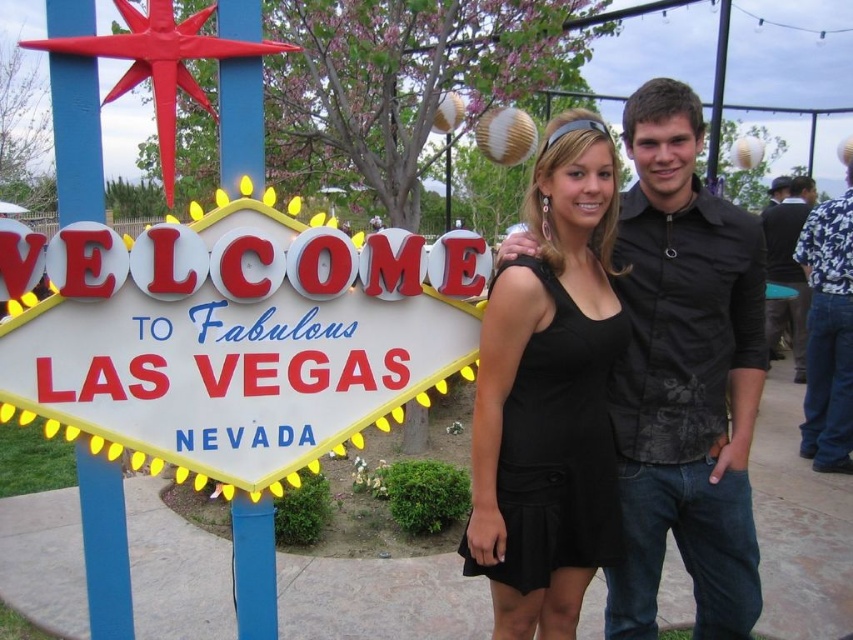
Question: Can you confirm if metallic red sign at left is positioned below black satin dress at center?

Choices:
 (A) yes
 (B) no

Answer: (B)

Question: Which point is farther to the camera?

Choices:
 (A) (775, 241)
 (B) (476, 396)
 (C) (677, 524)
 (D) (228, 452)

Answer: (A)

Question: Is black matte shirt at center below black satin dress at center?

Choices:
 (A) no
 (B) yes

Answer: (B)

Question: Which point is farther to the camera?

Choices:
 (A) (630, 422)
 (B) (577, 369)
 (C) (225, 260)

Answer: (A)

Question: Considering the relative positions of metallic red sign at left and black textured shirt at right in the image provided, where is metallic red sign at left located with respect to black textured shirt at right?

Choices:
 (A) right
 (B) left

Answer: (B)

Question: Which of the following is the closest to the observer?

Choices:
 (A) black textured shirt at right
 (B) metallic red sign at left
 (C) black matte shirt at center

Answer: (B)